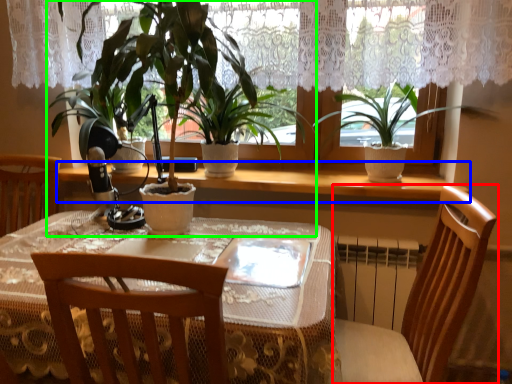
Question: Estimate the real-world distances between objects in this image. Which object is farther from chair (highlighted by a red box), window sill (highlighted by a blue box) or houseplant (highlighted by a green box)?

Choices:
 (A) window sill
 (B) houseplant

Answer: (B)